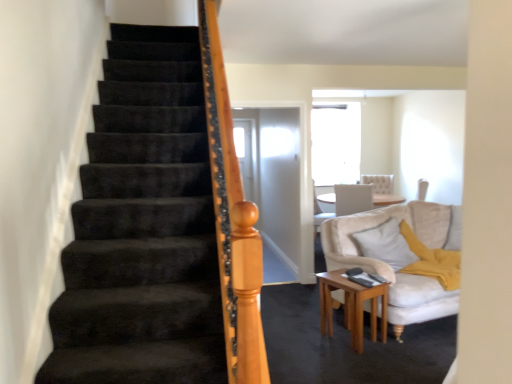
Where is `light brown wooden side table at lower right`? The width and height of the screenshot is (512, 384). light brown wooden side table at lower right is located at coordinates (352, 306).

Describe the element at coordinates (352, 306) in the screenshot. I see `light brown wooden side table at lower right` at that location.

Describe the element at coordinates (386, 244) in the screenshot. The image size is (512, 384). I see `soft white pillow at right` at that location.

At what (x,y) coordinates should I click in order to perform the action: click on soft white pillow at right. Please return your answer as a coordinate pair (x, y). The image size is (512, 384). Looking at the image, I should click on (386, 244).

What is the approximate height of soft white pillow at right?

It is 18.17 inches.

The width and height of the screenshot is (512, 384). What are the coordinates of `light brown wooden side table at lower right` in the screenshot? It's located at (352, 306).

In the scene shown: Can you confirm if light brown wooden side table at lower right is positioned to the right of soft white pillow at right?

In fact, light brown wooden side table at lower right is to the left of soft white pillow at right.

Between light brown wooden side table at lower right and soft white pillow at right, which one is positioned in front?

light brown wooden side table at lower right.

Does point (328, 302) come behind point (414, 258)?

No, (328, 302) is closer to viewer.

From the image's perspective, is light brown wooden side table at lower right beneath soft white pillow at right?

Yes.

From a real-world perspective, is light brown wooden side table at lower right under soft white pillow at right?

Yes, from a real-world perspective, light brown wooden side table at lower right is below soft white pillow at right.

Considering the sizes of objects light brown wooden side table at lower right and soft white pillow at right in the image provided, who is thinner, light brown wooden side table at lower right or soft white pillow at right?

With smaller width is soft white pillow at right.

Consider the image. Considering the relative sizes of light brown wooden side table at lower right and soft white pillow at right in the image provided, is light brown wooden side table at lower right shorter than soft white pillow at right?

Incorrect, the height of light brown wooden side table at lower right does not fall short of that of soft white pillow at right.

Does light brown wooden side table at lower right have a larger size compared to soft white pillow at right?

No, light brown wooden side table at lower right is not bigger than soft white pillow at right.

Is light brown wooden side table at lower right positioned beyond the bounds of soft white pillow at right?

Yes, light brown wooden side table at lower right is not within soft white pillow at right.

Can you see light brown wooden side table at lower right touching soft white pillow at right?

No, light brown wooden side table at lower right is not next to soft white pillow at right.

Is light brown wooden side table at lower right oriented towards soft white pillow at right?

No, light brown wooden side table at lower right is not turned towards soft white pillow at right.

How different are the orientations of light brown wooden side table at lower right and soft white pillow at right in degrees?

There is a 0.776-degree angle between the facing directions of light brown wooden side table at lower right and soft white pillow at right.

Identify the location of pillow above the light brown wooden side table at lower right (from a real-world perspective). (386, 244).

Between soft white pillow at right and light brown wooden side table at lower right, which one appears on the right side from the viewer's perspective?

Positioned to the right is soft white pillow at right.

Which object is more forward, soft white pillow at right or light brown wooden side table at lower right?

light brown wooden side table at lower right is more forward.

Is point (409, 253) positioned behind point (368, 288)?

That is True.

From the image's perspective, is soft white pillow at right above or below light brown wooden side table at lower right?

soft white pillow at right is above light brown wooden side table at lower right.

From a real-world perspective, does soft white pillow at right stand above light brown wooden side table at lower right?

Yes, from a real-world perspective, soft white pillow at right is on top of light brown wooden side table at lower right.

Does soft white pillow at right have a greater width compared to light brown wooden side table at lower right?

In fact, soft white pillow at right might be narrower than light brown wooden side table at lower right.

In terms of height, does soft white pillow at right look taller or shorter compared to light brown wooden side table at lower right?

Considering their sizes, soft white pillow at right has less height than light brown wooden side table at lower right.

Which of these two, soft white pillow at right or light brown wooden side table at lower right, is bigger?

soft white pillow at right.

Which is correct: soft white pillow at right is inside light brown wooden side table at lower right, or outside of it?

soft white pillow at right is spatially situated outside light brown wooden side table at lower right.

Would you consider soft white pillow at right to be distant from light brown wooden side table at lower right?

No, there isn't a large distance between soft white pillow at right and light brown wooden side table at lower right.

Is soft white pillow at right looking in the opposite direction of light brown wooden side table at lower right?

No, soft white pillow at right's orientation is not away from light brown wooden side table at lower right.

Can you tell me how much soft white pillow at right and light brown wooden side table at lower right differ in facing direction?

0.776 degrees.

Measure the distance between soft white pillow at right and light brown wooden side table at lower right.

The distance of soft white pillow at right from light brown wooden side table at lower right is 22.35 inches.

Find the location of a particular element. pillow on the right of light brown wooden side table at lower right is located at coordinates (386, 244).

There is a light brown wooden side table at lower right. Identify the location of pillow above it (from a real-world perspective). (386, 244).

Locate an element on the screen. This screenshot has width=512, height=384. table below the soft white pillow at right (from the image's perspective) is located at coordinates (352, 306).